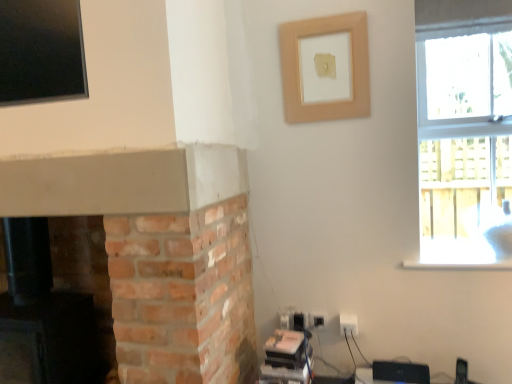
Question: Is clear glass window at upper right further to camera compared to white plastic electric outlet at lower right?

Choices:
 (A) no
 (B) yes

Answer: (A)

Question: Is white plastic electric outlet at lower right a part of clear glass window at upper right?

Choices:
 (A) no
 (B) yes

Answer: (A)

Question: From a real-world perspective, is clear glass window at upper right physically below white plastic electric outlet at lower right?

Choices:
 (A) no
 (B) yes

Answer: (A)

Question: Is clear glass window at upper right wider than white plastic electric outlet at lower right?

Choices:
 (A) no
 (B) yes

Answer: (B)

Question: Can you confirm if clear glass window at upper right is smaller than white plastic electric outlet at lower right?

Choices:
 (A) yes
 (B) no

Answer: (B)

Question: From a real-world perspective, is white plastic electric outlet at lower right positioned above or below clear glass window at upper right?

Choices:
 (A) above
 (B) below

Answer: (B)

Question: Looking at their shapes, would you say white plastic electric outlet at lower right is wider or thinner than clear glass window at upper right?

Choices:
 (A) wide
 (B) thin

Answer: (B)

Question: From the image's perspective, is white plastic electric outlet at lower right positioned above or below clear glass window at upper right?

Choices:
 (A) below
 (B) above

Answer: (A)

Question: Considering the positions of white plastic electric outlet at lower right and clear glass window at upper right in the image, is white plastic electric outlet at lower right taller or shorter than clear glass window at upper right?

Choices:
 (A) short
 (B) tall

Answer: (A)

Question: Considering the positions of white plastic electric outlet at lower right and brick fireplace at lower left in the image, is white plastic electric outlet at lower right taller or shorter than brick fireplace at lower left?

Choices:
 (A) short
 (B) tall

Answer: (A)

Question: From the image's perspective, is white plastic electric outlet at lower right located above or below brick fireplace at lower left?

Choices:
 (A) above
 (B) below

Answer: (B)

Question: In terms of size, does white plastic electric outlet at lower right appear bigger or smaller than brick fireplace at lower left?

Choices:
 (A) small
 (B) big

Answer: (A)

Question: Is white plastic electric outlet at lower right to the left or to the right of brick fireplace at lower left in the image?

Choices:
 (A) left
 (B) right

Answer: (B)

Question: Based on their sizes in the image, would you say clear glass window at upper right is bigger or smaller than white plastic electric outlet at lower right?

Choices:
 (A) big
 (B) small

Answer: (A)

Question: Relative to white plastic electric outlet at lower right, is clear glass window at upper right in front or behind?

Choices:
 (A) behind
 (B) front

Answer: (B)